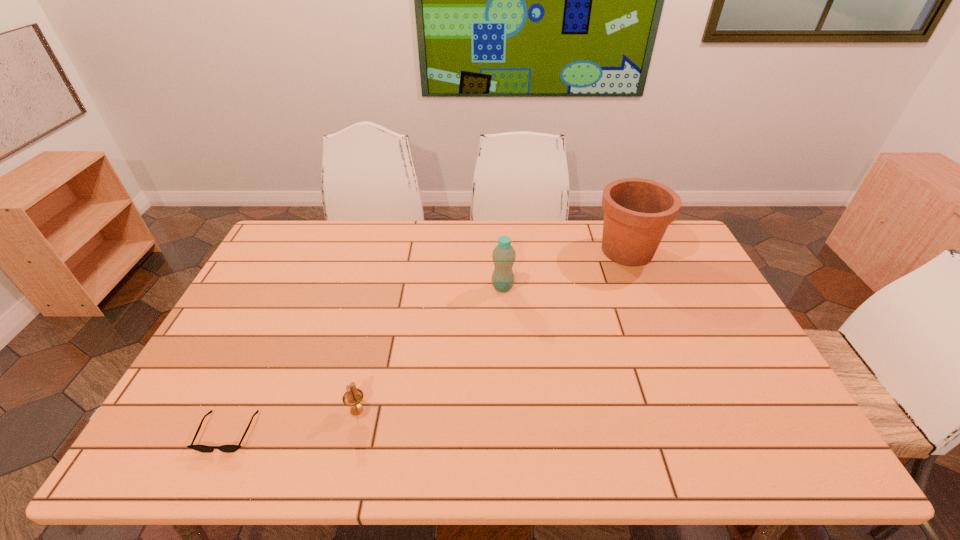
In the image, there is a desktop. Where is `free space at the near edge`? free space at the near edge is located at coordinates (692, 463).

Identify the location of vacant space at the left edge of the desktop. The height and width of the screenshot is (540, 960). (251, 316).

The image size is (960, 540). In the image, there is a desktop. What are the coordinates of `vacant space at the right edge` in the screenshot? It's located at (685, 337).

At what (x,y) coordinates should I click in order to perform the action: click on free space at the far left corner. Please return your answer as a coordinate pair (x, y). Image resolution: width=960 pixels, height=540 pixels. Looking at the image, I should click on (278, 239).

This screenshot has height=540, width=960. What are the coordinates of `free space at the far right corner of the desktop` in the screenshot? It's located at (676, 248).

Image resolution: width=960 pixels, height=540 pixels. Find the location of `vacant point located between the sunglasses and the third tallest object`. vacant point located between the sunglasses and the third tallest object is located at coordinates (293, 421).

Identify the location of empty space that is in between the second farthest object and the flowerpot. (564, 269).

The width and height of the screenshot is (960, 540). What are the coordinates of `vacant space that's between the rightmost object and the second object from right to left` in the screenshot? It's located at (564, 269).

This screenshot has height=540, width=960. Find the location of `empty space that is in between the candle holder and the second tallest object`. empty space that is in between the candle holder and the second tallest object is located at coordinates (430, 348).

You are a GUI agent. You are given a task and a screenshot of the screen. Output one action in this format:
    pyautogui.click(x=<x>, y=<y>)
    Task: Click on the vacant space in between the second object from left to right and the leftmost object
    This screenshot has width=960, height=540.
    Given the screenshot: What is the action you would take?
    pyautogui.click(x=293, y=421)